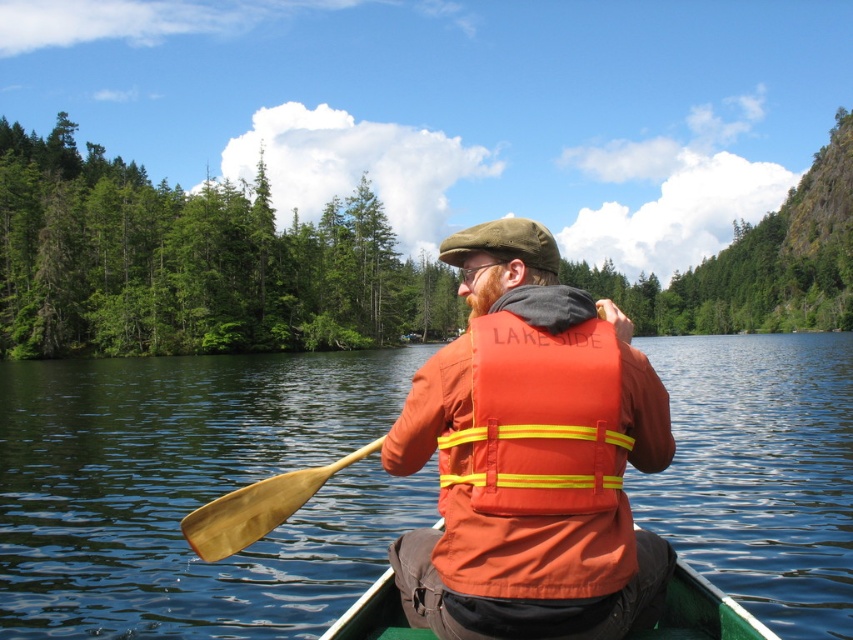
You are planning to take a photo of the green leafy trees at left and the green plastic canoe at center from the shore. Which object will appear larger in the photo?

The green leafy trees at left will appear larger in the photo because they are taller than the green plastic canoe at center.

You are planning to store the green plastic canoe at center and the wooden paddle at lower left in a storage room that is 1.2 meters wide. Based on their sizes, will both items fit side by side within the storage room?

The green plastic canoe at center is narrower than the wooden paddle at lower left. Since the combined width of both items would exceed the storage room width of 1.2 meters, they cannot fit side by side.

Looking at this image, you are navigating a canoe on a serene lake surrounded by tall evergreen trees. You notice a specific point marked at coordinates (193,490). What is located at this point?

The point at coordinates (193,490) has transparent water at center.